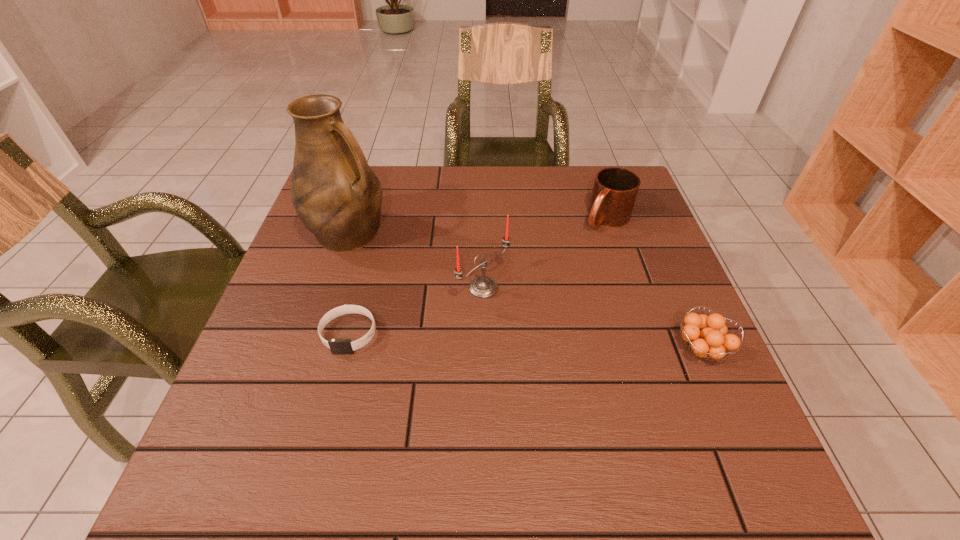
You are a GUI agent. You are given a task and a screenshot of the screen. Output one action in this format:
    pyautogui.click(x=<x>, y=<y>)
    Task: Click on the free space on the desktop that is between the shortest object and the orange fruit and is positioned on the handle side of the pitcher
    
    Given the screenshot: What is the action you would take?
    pyautogui.click(x=527, y=342)

Locate an element on the screen. vacant space on the desktop that is between the wristband and the orange fruit and is positioned on the front-facing side of the candle is located at coordinates (561, 343).

The height and width of the screenshot is (540, 960). What are the coordinates of `vacant space on the desktop that is between the wristband and the orange fruit and is positioned on the side of the third shortest object with the handle` in the screenshot? It's located at (478, 340).